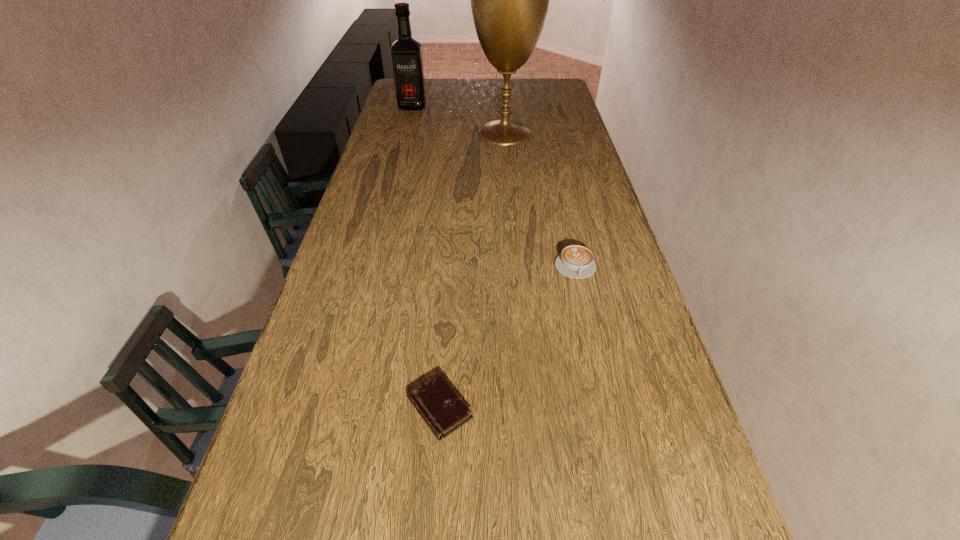
Identify the location of empty space between the shortest object and the second farthest object. pos(472,271).

The height and width of the screenshot is (540, 960). Find the location of `vacant space that is in between the trophy cup and the liquor`. vacant space that is in between the trophy cup and the liquor is located at coordinates (459, 120).

Locate an element on the screen. empty space between the trophy cup and the shortest object is located at coordinates (472, 271).

Where is `vacant area between the tallest object and the farthest object`? vacant area between the tallest object and the farthest object is located at coordinates (459, 120).

Locate an element on the screen. vacant point located between the tallest object and the leftmost object is located at coordinates (459, 120).

The image size is (960, 540). What are the coordinates of `free space between the liquor and the tallest object` in the screenshot? It's located at (459, 120).

Image resolution: width=960 pixels, height=540 pixels. I want to click on free space between the third nearest object and the second shortest object, so point(540,200).

This screenshot has height=540, width=960. In order to click on object identified as the second closest to the nearest object in this screenshot , I will do `click(509, 0)`.

Find the location of a particular element. object that is the closest to the diary is located at coordinates (575, 261).

Locate an element on the screen. vacant area that satisfies the following two spatial constraints: 1. on the front-facing side of the diary; 2. on the right side of the farthest object is located at coordinates (332, 408).